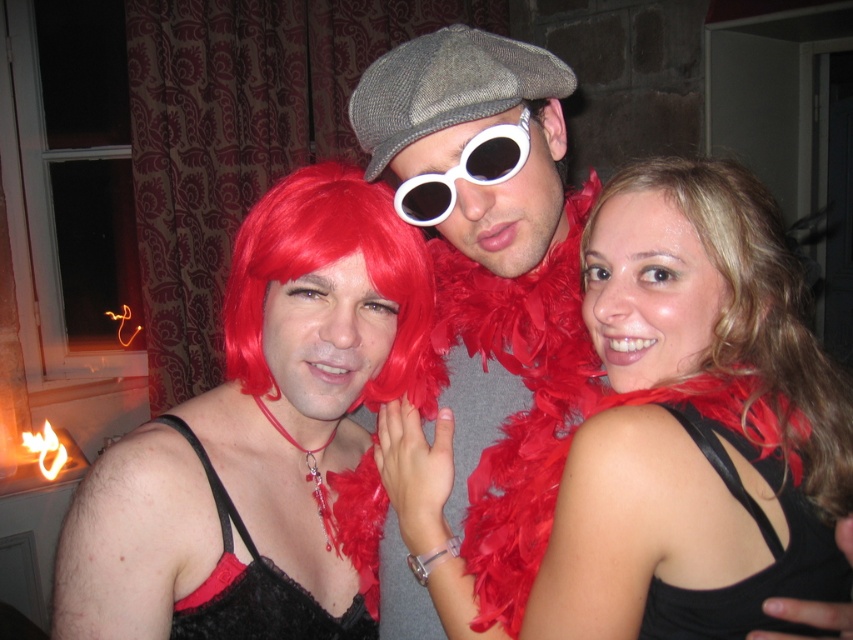
Who is more distant from viewer, [314,268] or [410,211]?

Positioned behind is point [410,211].

Between point (119, 442) and point (413, 214), which one is positioned behind?

The point (413, 214) is behind.

Image resolution: width=853 pixels, height=640 pixels. What are the coordinates of `shiny red wig at center` in the screenshot? It's located at (262, 429).

Is shiny red wig at center to the left of textured gray cap at center from the viewer's perspective?

Yes, shiny red wig at center is to the left of textured gray cap at center.

How much distance is there between shiny red wig at center and textured gray cap at center?

shiny red wig at center is 5.13 inches away from textured gray cap at center.

The image size is (853, 640). In order to click on shiny red wig at center in this screenshot , I will do `click(262, 429)`.

Can you confirm if shiny red wig at center is smaller than black satin dress at center?

No, shiny red wig at center is not smaller than black satin dress at center.

Is shiny red wig at center above black satin dress at center?

Correct, shiny red wig at center is located above black satin dress at center.

Locate an element on the screen. shiny red wig at center is located at coordinates (262, 429).

I want to click on shiny red wig at center, so click(262, 429).